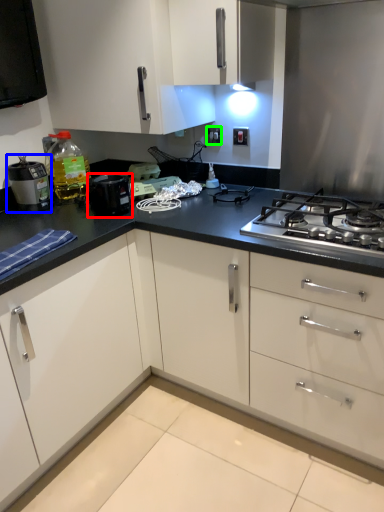
Question: Considering the real-world distances, which object is farthest from kitchen appliance (highlighted by a red box)? kitchen appliance (highlighted by a blue box) or electric outlet (highlighted by a green box)?

Choices:
 (A) kitchen appliance
 (B) electric outlet

Answer: (B)